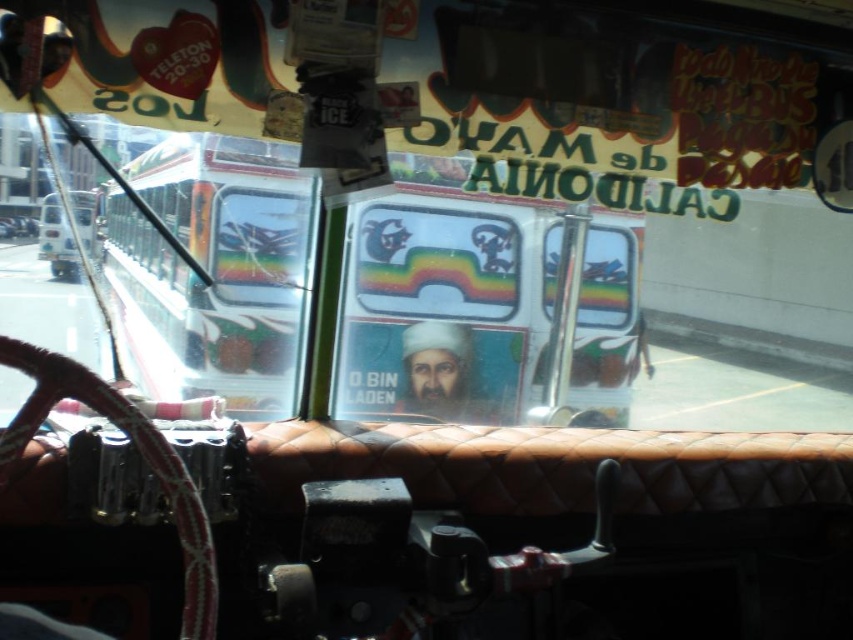
You are driving a car and notice two points on the windshield. The first point is at coordinates point (x=434, y=369) and the second is at point (x=90, y=205). Which point is closer to you?

Point (x=90, y=205) is closer to you because it is in front of point (x=434, y=369).

You are a driver who needs to determine if the matte plastic poster at center can be placed on a shelf that can hold items wider than the white glossy bus at left. Can it fit?

The matte plastic poster at center is wider than the white glossy bus at left, so it can fit on the shelf if the shelf can hold items wider than the white glossy bus at left.

In the scene shown: You are a passenger on a bus and you notice two objects in your view through the windshield. One is the metallic silver bus at left and the other is the matte plastic poster at center. Which object is positioned to the left of the other?

The metallic silver bus at left is positioned to the left of the matte plastic poster at center.